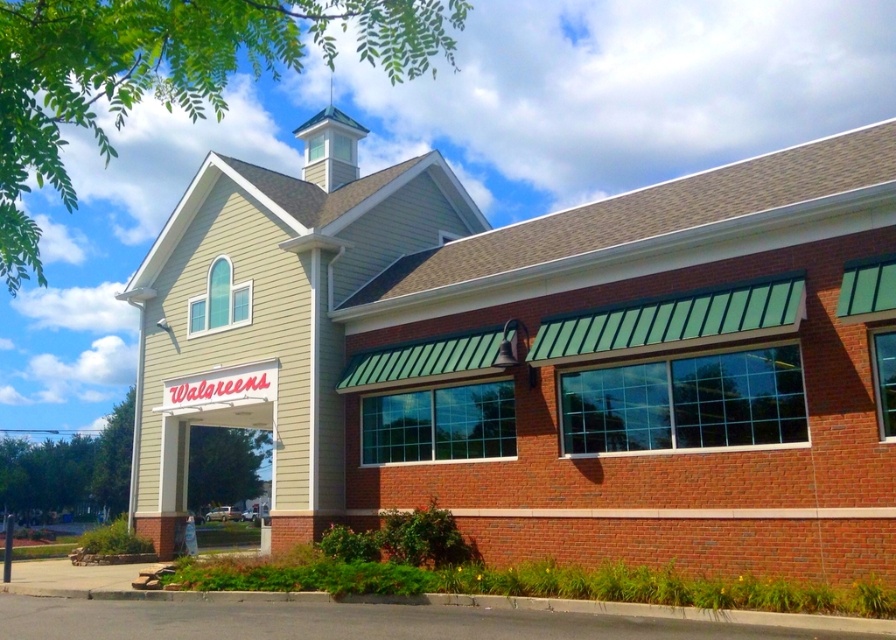
Can you confirm if beige siding church at center is wider than white painted wood spire at upper center?

Yes, beige siding church at center is wider than white painted wood spire at upper center.

Based on the photo, can you confirm if beige siding church at center is positioned to the right of white painted wood spire at upper center?

Correct, you'll find beige siding church at center to the right of white painted wood spire at upper center.

Locate an element on the screen. The image size is (896, 640). beige siding church at center is located at coordinates coord(543,358).

Where is `beige siding church at center`? The image size is (896, 640). beige siding church at center is located at coordinates (543, 358).

Between white matte sign at center and white painted wood spire at upper center, which one has more height?

With more height is white painted wood spire at upper center.

Does point (182, 404) come in front of point (317, 168)?

Yes, it is.

Is point (171, 387) closer to camera compared to point (332, 138)?

Yes, point (171, 387) is closer to viewer.

This screenshot has width=896, height=640. What are the coordinates of `white matte sign at center` in the screenshot? It's located at (202, 424).

Between beige siding church at center and white matte sign at center, which one has less height?

With less height is white matte sign at center.

Does point (800, 166) come in front of point (210, 422)?

Yes, point (800, 166) is closer to viewer.

This screenshot has width=896, height=640. Find the location of `beige siding church at center`. beige siding church at center is located at coordinates (543, 358).